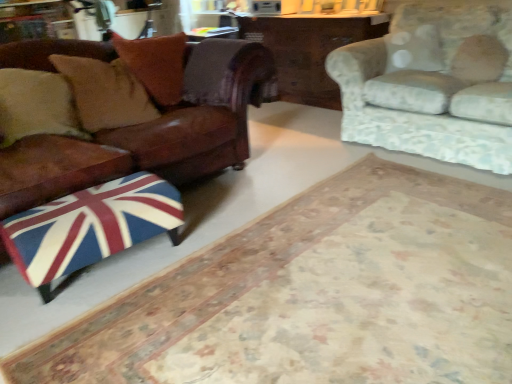
This screenshot has width=512, height=384. Identify the location of vacant space underneath union jack fabric ottoman at lower left (from a real-world perspective). (351, 276).